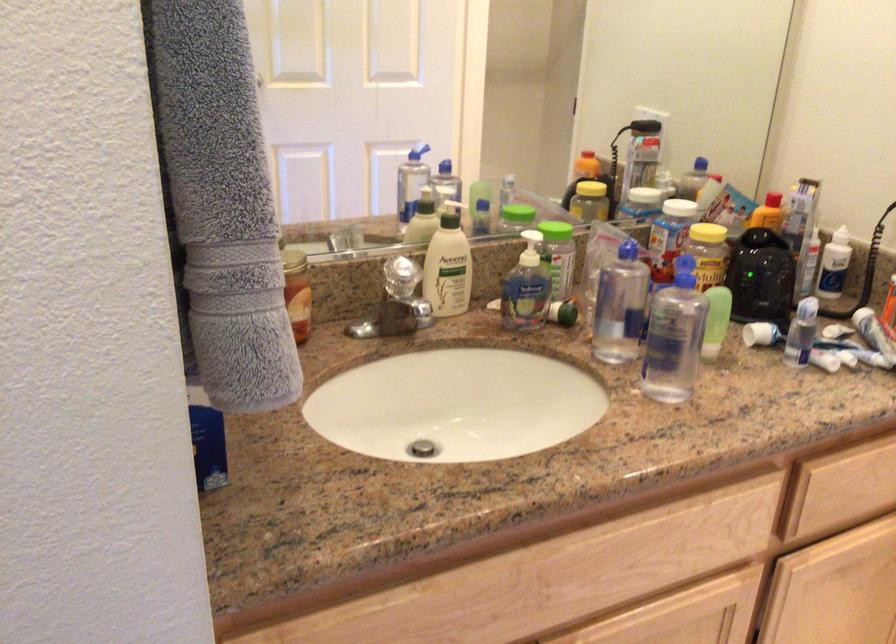
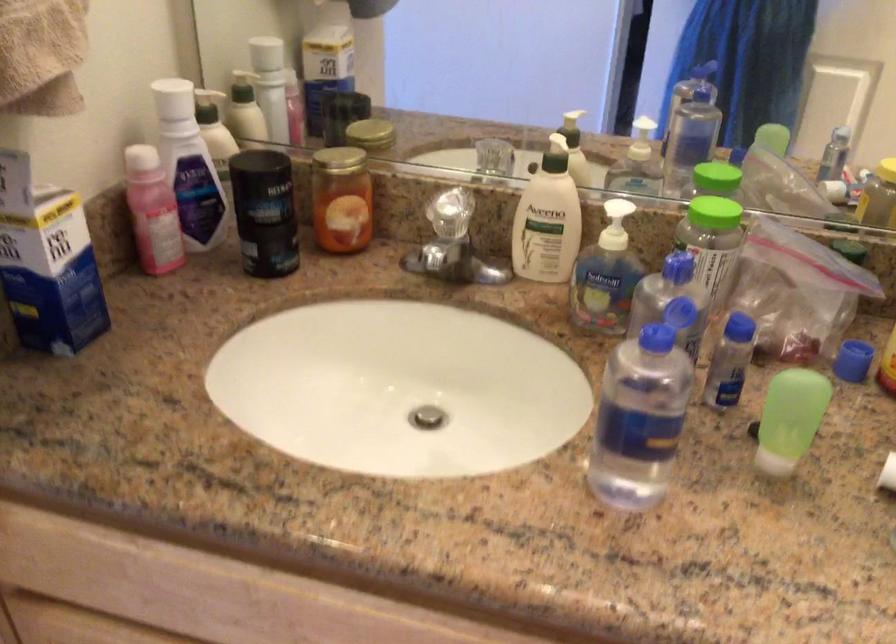
The point at [724,315] is marked in the first image. Where is the corresponding point in the second image?

(789, 419)